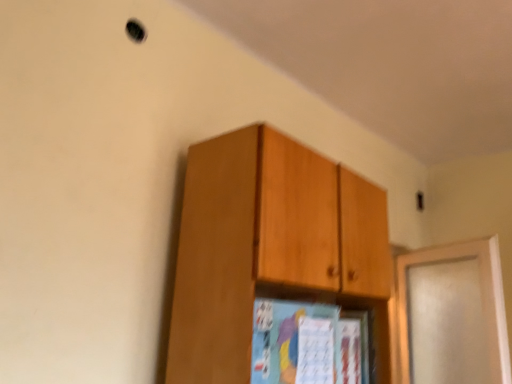
Question: In the image, is wooden cabinet at upper center on the left side or the right side of satin white door at right?

Choices:
 (A) right
 (B) left

Answer: (B)

Question: Is wooden cabinet at upper center wider or thinner than satin white door at right?

Choices:
 (A) wide
 (B) thin

Answer: (A)

Question: Considering the positions of point (297, 243) and point (453, 364), is point (297, 243) closer or farther from the camera than point (453, 364)?

Choices:
 (A) closer
 (B) farther

Answer: (A)

Question: From the image's perspective, is satin white door at right located above or below wooden cabinet at upper center?

Choices:
 (A) above
 (B) below

Answer: (B)

Question: Is satin white door at right spatially inside wooden cabinet at upper center, or outside of it?

Choices:
 (A) inside
 (B) outside

Answer: (B)

Question: Is point tap(495, 291) positioned closer to the camera than point tap(245, 284)?

Choices:
 (A) farther
 (B) closer

Answer: (A)

Question: From a real-world perspective, is satin white door at right positioned above or below wooden cabinet at upper center?

Choices:
 (A) above
 (B) below

Answer: (B)